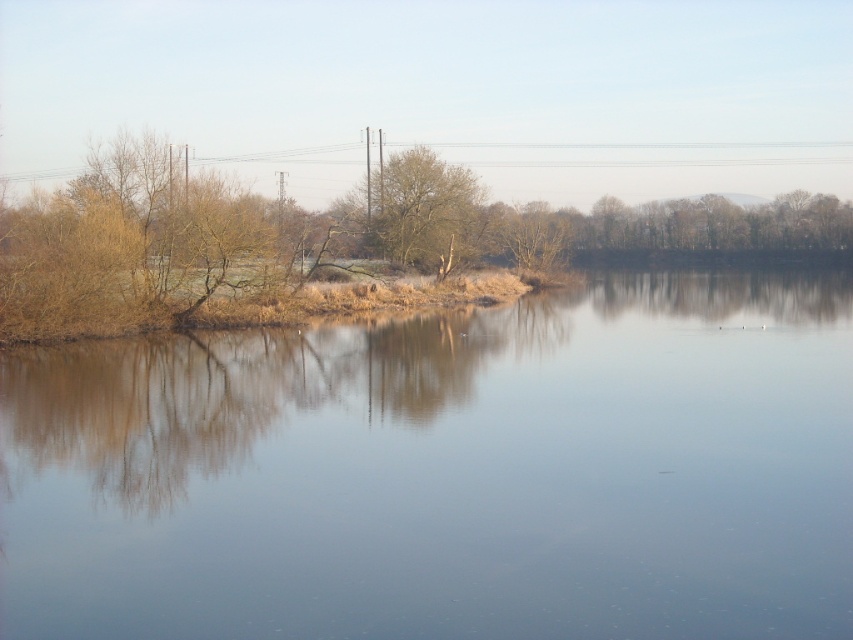
Question: Which point appears closest to the camera in this image?

Choices:
 (A) (473, 237)
 (B) (225, 324)
 (C) (202, 481)

Answer: (C)

Question: Is smooth water at center further to the viewer compared to brown/dry grass at left?

Choices:
 (A) no
 (B) yes

Answer: (A)

Question: Is smooth water at center bigger than brown textured tree at center?

Choices:
 (A) yes
 (B) no

Answer: (A)

Question: Does brown/dry grass at left lie behind brown textured tree at center?

Choices:
 (A) no
 (B) yes

Answer: (A)

Question: Estimate the real-world distances between objects in this image. Which object is farther from the brown textured tree at center?

Choices:
 (A) brown/dry grass at left
 (B) smooth water at center

Answer: (B)

Question: Which point is farther to the camera?

Choices:
 (A) brown/dry grass at left
 (B) brown textured tree at center

Answer: (B)